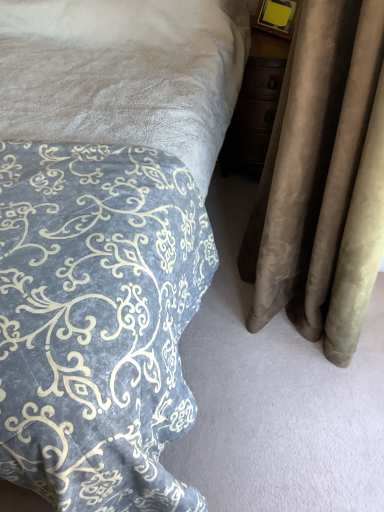
Question: From the image's perspective, would you say velvet-patterned bedspread at lower left is shown under suede curtain at right?

Choices:
 (A) no
 (B) yes

Answer: (B)

Question: From a real-world perspective, is velvet-patterned bedspread at lower left below suede curtain at right?

Choices:
 (A) yes
 (B) no

Answer: (A)

Question: Is velvet-patterned bedspread at lower left oriented away from suede curtain at right?

Choices:
 (A) no
 (B) yes

Answer: (A)

Question: Is velvet-patterned bedspread at lower left far away from suede curtain at right?

Choices:
 (A) yes
 (B) no

Answer: (B)

Question: Does velvet-patterned bedspread at lower left appear on the right side of suede curtain at right?

Choices:
 (A) no
 (B) yes

Answer: (A)

Question: Is velvet-patterned bedspread at lower left further to camera compared to suede curtain at right?

Choices:
 (A) yes
 (B) no

Answer: (B)

Question: Does suede curtain at right have a larger size compared to velvet-patterned bedspread at lower left?

Choices:
 (A) yes
 (B) no

Answer: (B)

Question: Could you tell me if suede curtain at right is facing velvet-patterned bedspread at lower left?

Choices:
 (A) yes
 (B) no

Answer: (A)

Question: Considering the relative sizes of suede curtain at right and velvet-patterned bedspread at lower left in the image provided, is suede curtain at right wider than velvet-patterned bedspread at lower left?

Choices:
 (A) yes
 (B) no

Answer: (B)

Question: Is velvet-patterned bedspread at lower left inside suede curtain at right?

Choices:
 (A) yes
 (B) no

Answer: (B)

Question: Is suede curtain at right facing away from velvet-patterned bedspread at lower left?

Choices:
 (A) no
 (B) yes

Answer: (A)

Question: From the image's perspective, is suede curtain at right under velvet-patterned bedspread at lower left?

Choices:
 (A) no
 (B) yes

Answer: (A)

Question: Is velvet-patterned bedspread at lower left to the left or to the right of suede curtain at right in the image?

Choices:
 (A) right
 (B) left

Answer: (B)